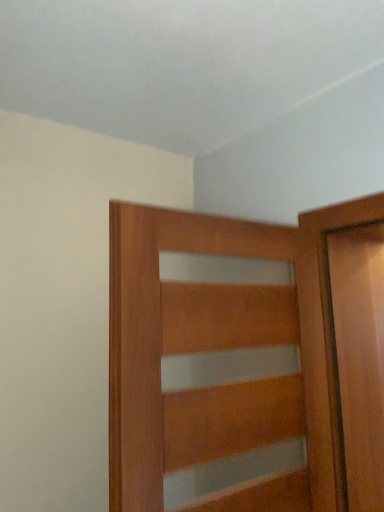
At what (x,y) coordinates should I click in order to perform the action: click on wooden door at center. Please return your answer as a coordinate pair (x, y). Image resolution: width=384 pixels, height=512 pixels. Looking at the image, I should click on (249, 351).

Measure the distance between point [126,302] and camera.

3.29 feet.

This screenshot has width=384, height=512. Describe the element at coordinates (249, 351) in the screenshot. I see `wooden door at center` at that location.

Find the location of a particular element. Image resolution: width=384 pixels, height=512 pixels. wooden door at center is located at coordinates (249, 351).